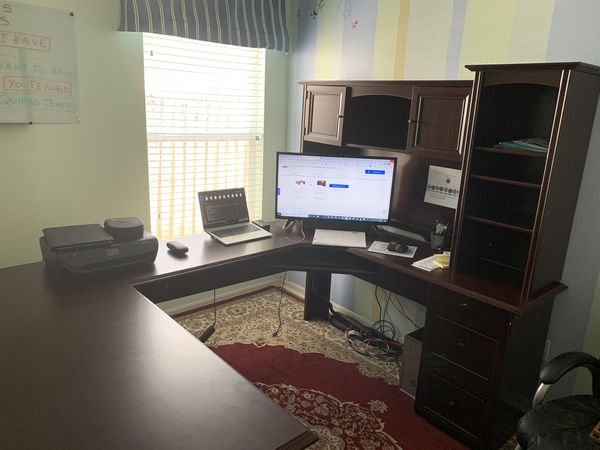
Where is `mouse pad`? mouse pad is located at coordinates (379, 245).